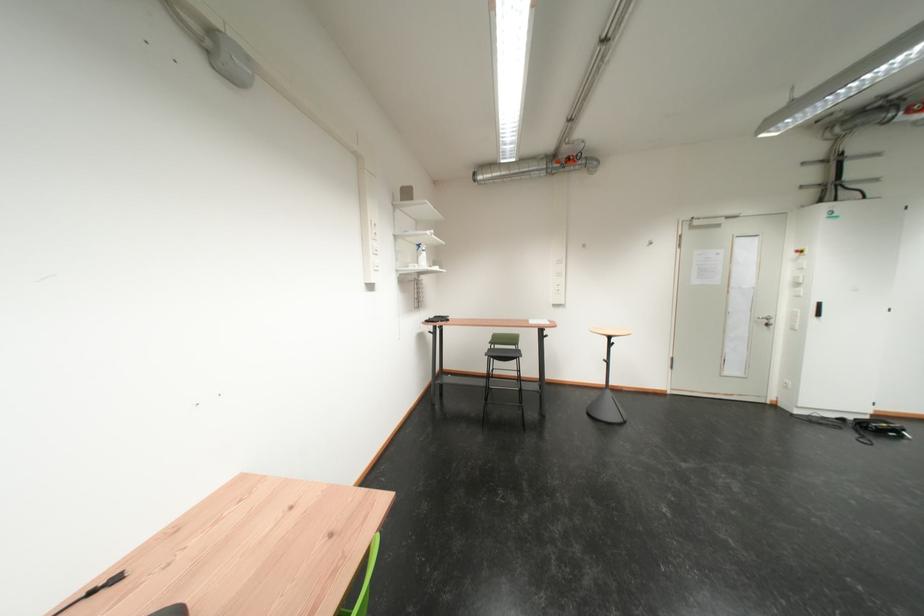
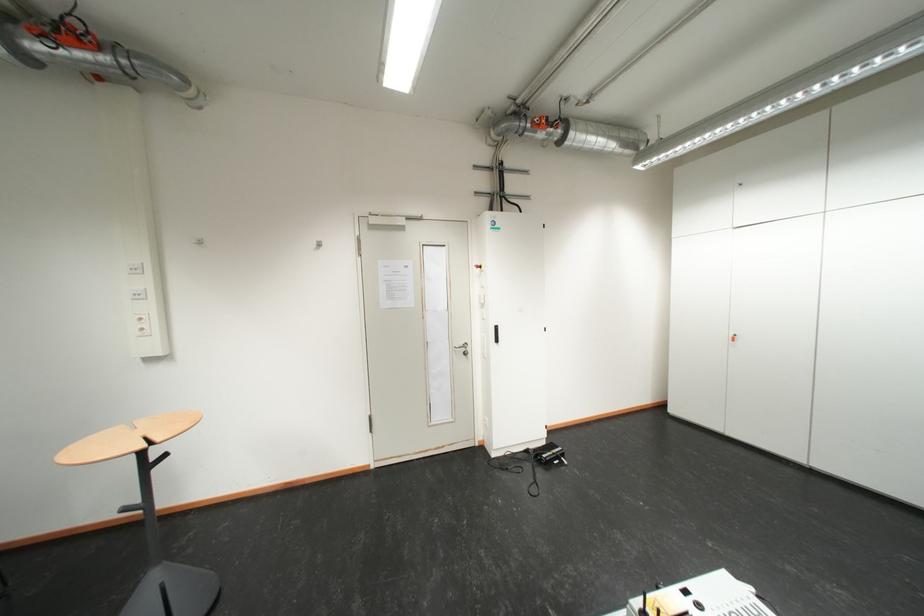
The point at (569, 264) is marked in the first image. Where is the corresponding point in the second image?

(144, 272)